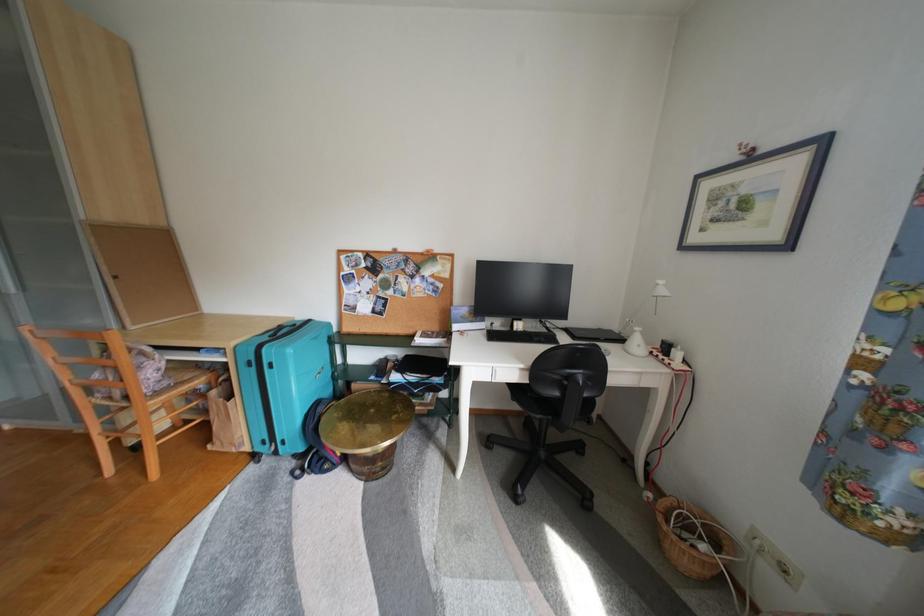
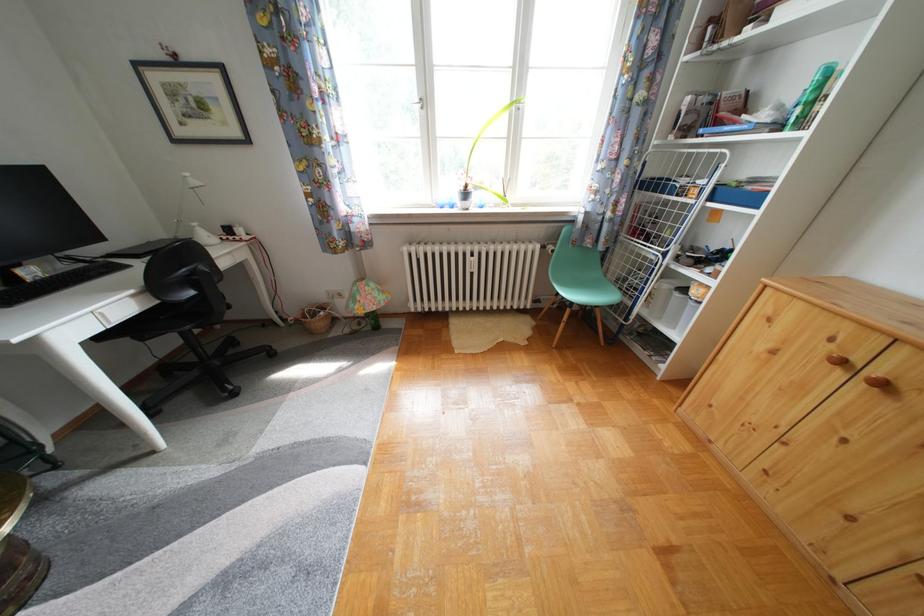
The first image is from the beginning of the video and the second image is from the end. How did the camera likely rotate when shooting the video?

The rotation direction of the camera is right-down.